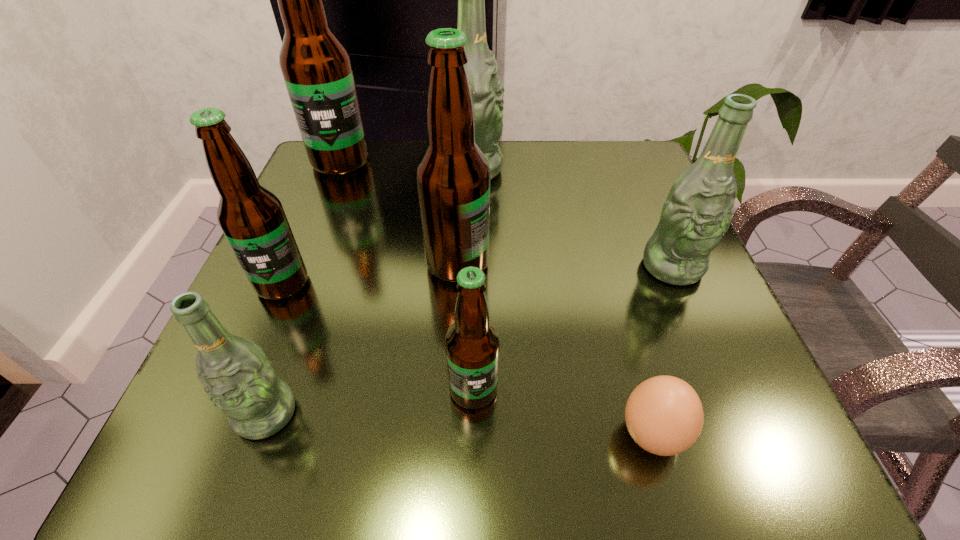
Identify which object is located as the sixth nearest to the smallest green beer bottle. Please provide its 2D coordinates. Your answer should be formatted as a tuple, i.e. [(x, y)], where the tuple contains the x and y coordinates of a point satisfying the conditions above.

[(316, 66)]

Locate an element on the screen. beer bottle identified as the second closest to the brown boiled egg is located at coordinates (697, 212).

The image size is (960, 540). What are the coordinates of `beer bottle that is the fifth closest to the second nearest green beer bottle` in the screenshot? It's located at (252, 218).

Find the location of a particular element. brown beer bottle that can be found as the second closest to the nearest brown beer bottle is located at coordinates (252, 218).

At what (x,y) coordinates should I click in order to perform the action: click on brown beer bottle that is the second closest one to the third smallest brown beer bottle. Please return your answer as a coordinate pair (x, y). Looking at the image, I should click on (252, 218).

You are a GUI agent. You are given a task and a screenshot of the screen. Output one action in this format:
    pyautogui.click(x=<x>, y=<y>)
    Task: Click on the closest green beer bottle relative to the third biggest brown beer bottle
    Image resolution: width=960 pixels, height=540 pixels.
    Given the screenshot: What is the action you would take?
    click(x=239, y=379)

Identify which green beer bottle is the closest to the nearest brown beer bottle. Please provide its 2D coordinates. Your answer should be formatted as a tuple, i.e. [(x, y)], where the tuple contains the x and y coordinates of a point satisfying the conditions above.

[(239, 379)]

Where is `vacant space that satisfies the following two spatial constraints: 1. on the surface of the second green beer bottle from left to right; 2. on the surface of the nearest green beer bottle`? This screenshot has height=540, width=960. vacant space that satisfies the following two spatial constraints: 1. on the surface of the second green beer bottle from left to right; 2. on the surface of the nearest green beer bottle is located at coordinates (468, 414).

Where is `vacant space that satisfies the following two spatial constraints: 1. on the surface of the second object from right to left; 2. on the left side of the farthest green beer bottle`? vacant space that satisfies the following two spatial constraints: 1. on the surface of the second object from right to left; 2. on the left side of the farthest green beer bottle is located at coordinates (468, 435).

Where is `free location that satisfies the following two spatial constraints: 1. on the label of the second biggest brown beer bottle; 2. on the surface of the smallest green beer bottle`? free location that satisfies the following two spatial constraints: 1. on the label of the second biggest brown beer bottle; 2. on the surface of the smallest green beer bottle is located at coordinates (450, 414).